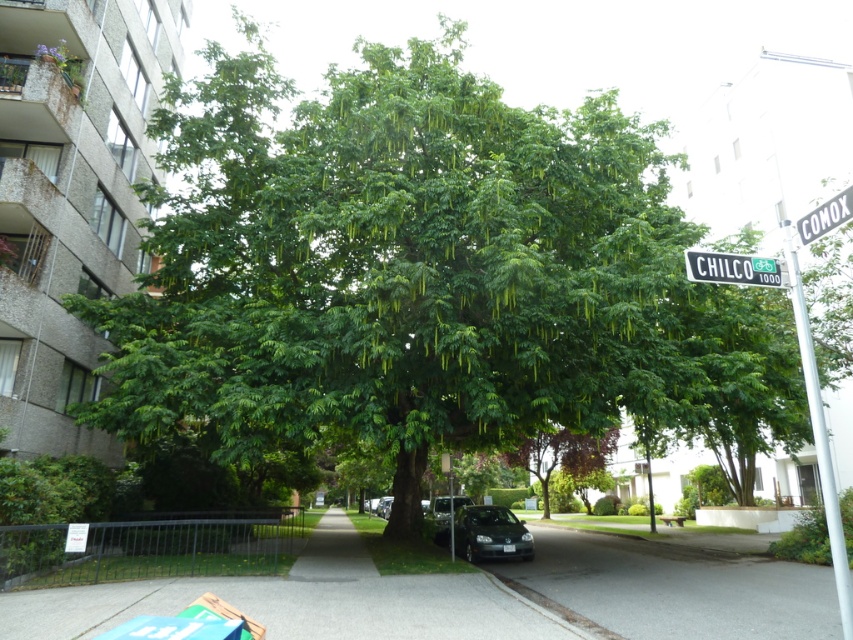
Question: Is the position of white plastic street sign at upper right less distant than that of shiny silver sedan at center?

Choices:
 (A) no
 (B) yes

Answer: (B)

Question: Which of the following is the farthest from the observer?

Choices:
 (A) (815, 211)
 (B) (596, 465)
 (C) (381, 499)
 (D) (463, 529)

Answer: (C)

Question: Can you confirm if purple-leaved tree at center is thinner than white plastic street sign at upper right?

Choices:
 (A) yes
 (B) no

Answer: (B)

Question: Is black plastic street sign at upper center closer to the viewer compared to shiny silver sedan at center?

Choices:
 (A) no
 (B) yes

Answer: (B)

Question: Which object appears farthest from the camera in this image?

Choices:
 (A) white plastic street sign at upper right
 (B) black plastic street sign at upper center
 (C) silver metallic pole at upper right

Answer: (B)

Question: Among these objects, which one is farthest from the camera?

Choices:
 (A) silver metallic pole at upper right
 (B) shiny black car at center
 (C) white plastic street sign at upper right

Answer: (B)